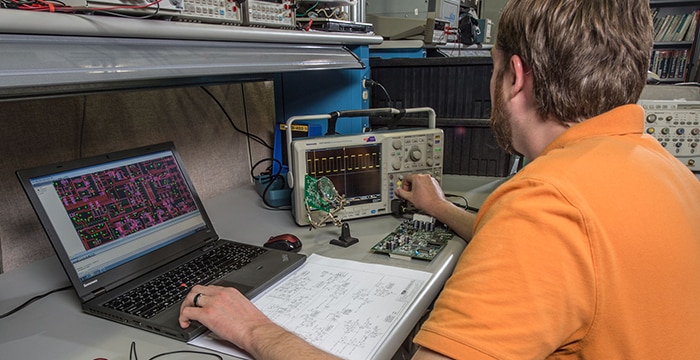
Locate an element on the screen. The height and width of the screenshot is (360, 700). mouse is located at coordinates (283, 239).